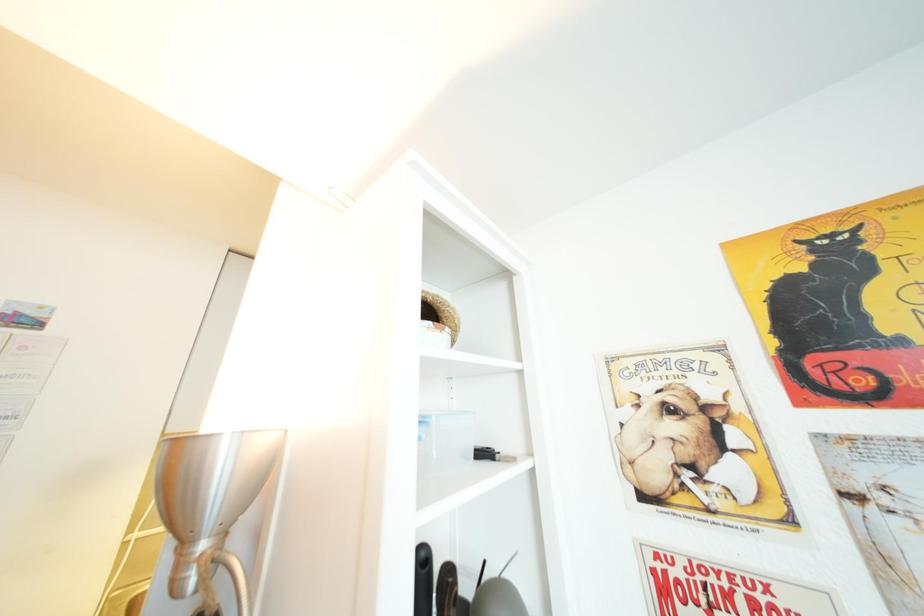
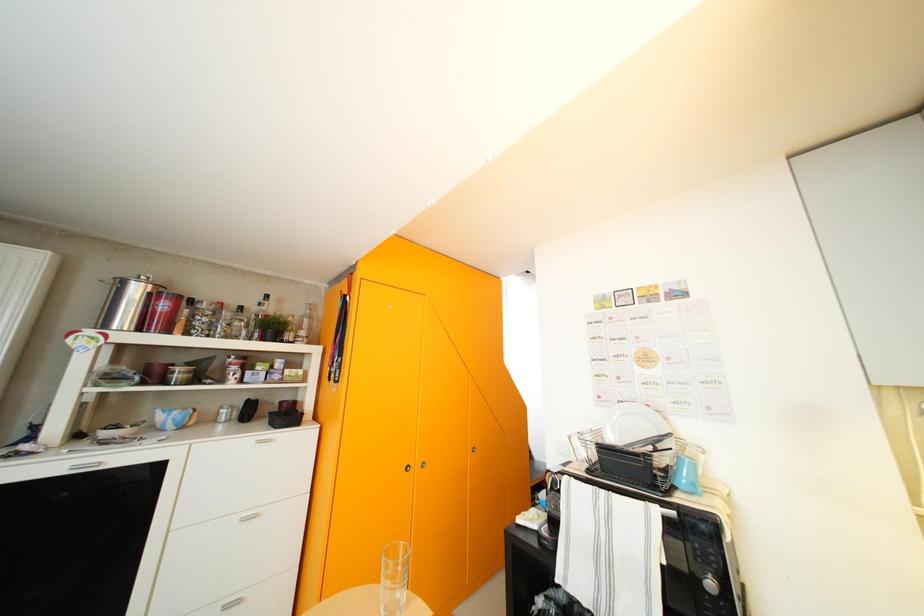
Question: Based on the continuous images, in which direction is the camera rotating? Reply with the corresponding letter.

Choices:
 (A) Left
 (B) Right
 (C) Up
 (D) Down

Answer: (A)